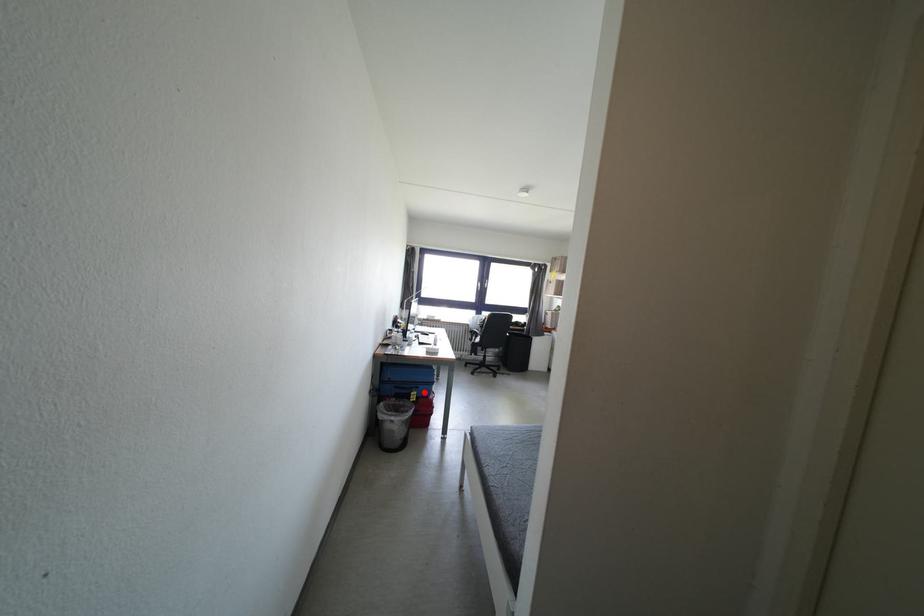
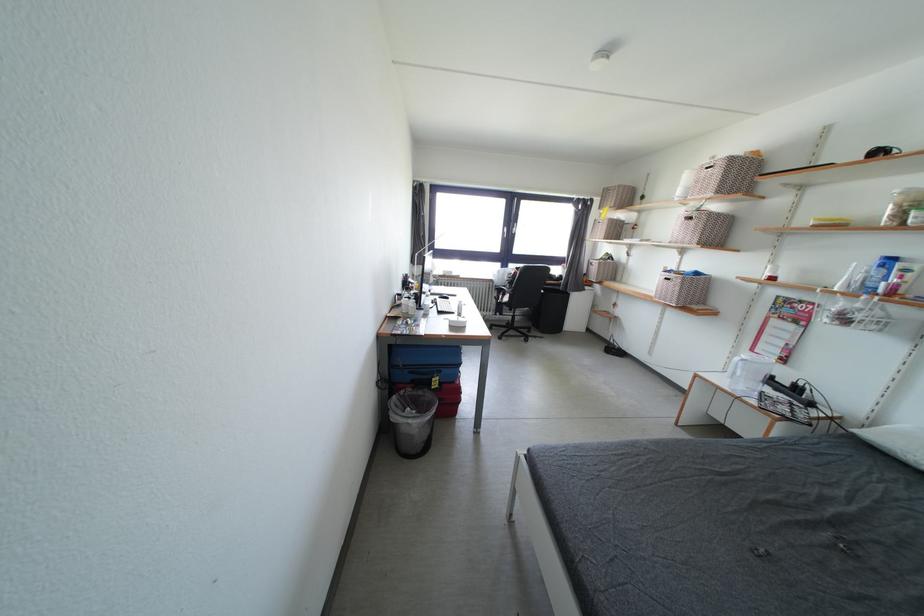
Find the pixel in the second image that matches the highlighted location in the first image.

(446, 377)